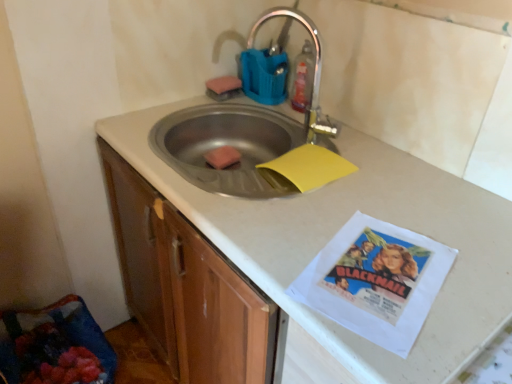
Identify the location of free spot in front of yellow matte paper at sink. The height and width of the screenshot is (384, 512). (318, 213).